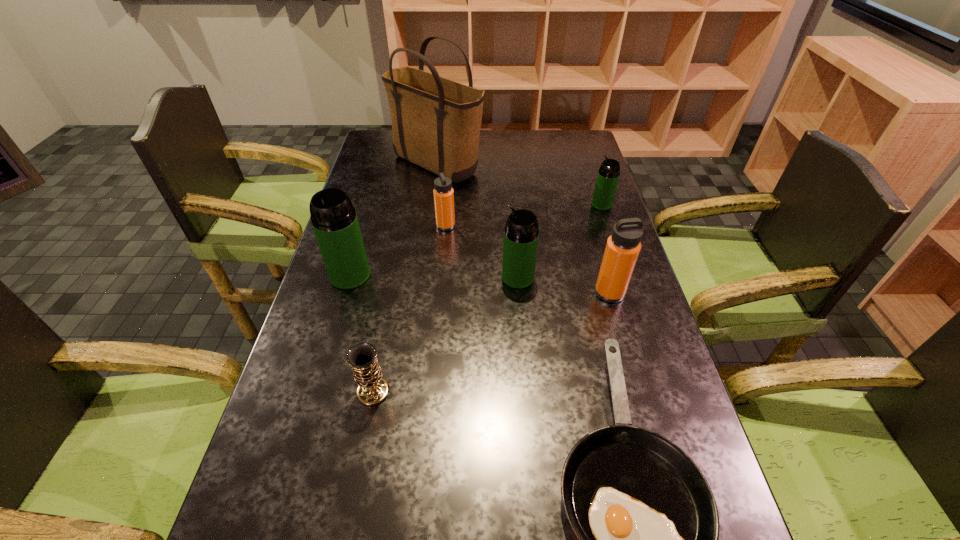
Locate an element on the screen. This screenshot has height=540, width=960. free spot located from the spout of the seventh nearest object is located at coordinates (518, 204).

Locate an element on the screen. free point located from the spout of the seventh nearest object is located at coordinates 537,204.

In order to click on vacant space located 0.300m on the right of the sixth nearest object in this screenshot , I will do `click(552, 226)`.

What are the coordinates of `blank space located on the front of the second shortest object` in the screenshot? It's located at (359, 469).

Locate an element on the screen. object at the far edge is located at coordinates (436, 122).

Locate an element on the screen. tote bag that is positioned at the left edge is located at coordinates (436, 122).

At what (x,y) coordinates should I click in order to perform the action: click on thermos bottle at the left edge. Please return your answer as a coordinate pair (x, y). The height and width of the screenshot is (540, 960). Looking at the image, I should click on (334, 220).

The image size is (960, 540). Find the location of `chalice at the left edge`. chalice at the left edge is located at coordinates [x=372, y=390].

Locate an element on the screen. object at the far left corner is located at coordinates (436, 122).

The image size is (960, 540). I want to click on free spot at the left edge of the desktop, so click(292, 401).